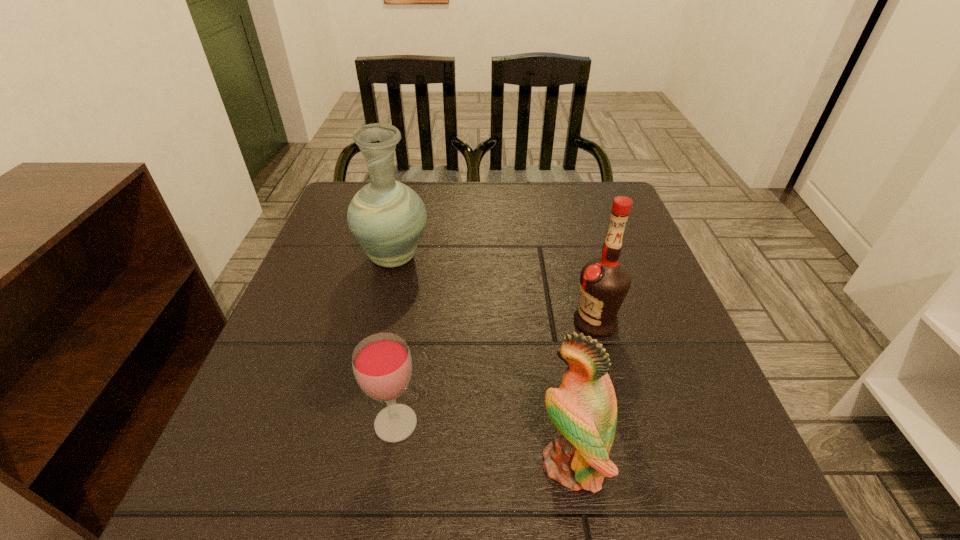
Locate an element on the screen. vacant space located on the front-facing side of the parrot is located at coordinates (371, 463).

Find the location of `free spot located on the front-facing side of the parrot`. free spot located on the front-facing side of the parrot is located at coordinates (404, 463).

The image size is (960, 540). What are the coordinates of `blank space located on the front-facing side of the parrot` in the screenshot? It's located at 384,463.

The height and width of the screenshot is (540, 960). In order to click on vacant space positioned on the back of the shortest object in this screenshot , I will do `click(409, 342)`.

Find the location of a particular element. This screenshot has width=960, height=540. object that is at the near edge is located at coordinates (584, 409).

Locate an element on the screen. This screenshot has width=960, height=540. object that is at the left edge is located at coordinates (387, 218).

This screenshot has width=960, height=540. What are the coordinates of `object situated at the right edge` in the screenshot? It's located at (604, 282).

Find the location of a particular element. Image resolution: width=960 pixels, height=540 pixels. vacant space at the far edge of the desktop is located at coordinates (528, 212).

Where is `free space at the near edge of the desktop`? The width and height of the screenshot is (960, 540). free space at the near edge of the desktop is located at coordinates (636, 505).

This screenshot has width=960, height=540. I want to click on vacant region at the left edge, so click(276, 334).